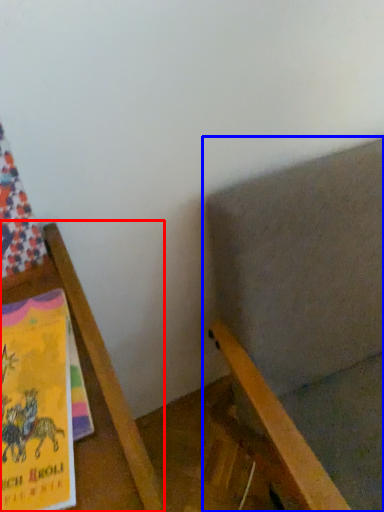
Question: Which object appears closest to the camera in this image, furniture (highlighted by a red box) or chair (highlighted by a blue box)?

Choices:
 (A) furniture
 (B) chair

Answer: (A)